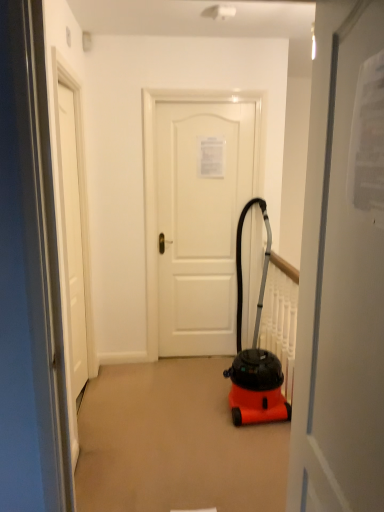
I want to click on white matte door at center, placed as the 2th door when sorted from front to back, so click(x=72, y=240).

Identify the location of white matte door at center, positioned as the 3th door in front-to-back order. (201, 221).

Measure the distance between point (x=317, y=465) and camera.

Point (x=317, y=465) and camera are 3.73 feet apart.

What are the coordinates of `white matte door at center, placed as the 2th door when sorted from front to back` in the screenshot? It's located at (72, 240).

Is white matte door at center, arranged as the 1th door when viewed from the front, facing towards white matte door at center, placed as the 2th door when sorted from front to back?

No, white matte door at center, arranged as the 1th door when viewed from the front, is not oriented towards white matte door at center, placed as the 2th door when sorted from front to back.

From the image's perspective, between white matte door at center, placed as the 3th door when sorted from back to front, and white matte door at center, placed as the 2th door when sorted from front to back, which one is located above?

white matte door at center, placed as the 2th door when sorted from front to back, is shown above in the image.

Is the depth of white matte door at center, arranged as the 1th door when viewed from the right, less than that of white matte door at center, the first door when ordered from left to right?

Yes, white matte door at center, arranged as the 1th door when viewed from the right, is closer to the camera.

Could you measure the distance between white matte door at center, placed as the 2th door when sorted from front to back, and white matte door at center, positioned as the 3th door in front-to-back order?

white matte door at center, placed as the 2th door when sorted from front to back, is 35.79 inches from white matte door at center, positioned as the 3th door in front-to-back order.

Could you tell me if white matte door at center, the first door when ordered from left to right, is facing white matte door at center, the 2th door in the left-to-right sequence?

Yes, white matte door at center, the first door when ordered from left to right, is facing white matte door at center, the 2th door in the left-to-right sequence.

From a real-world perspective, which is physically below, white matte door at center, placed as the 2th door when sorted from front to back, or white matte door at center, positioned as the 3th door in front-to-back order?

From a 3D spatial view, white matte door at center, placed as the 2th door when sorted from front to back, is below.

Who is shorter, white matte door at center, placed as the 2th door when sorted from front to back, or white matte door at center, positioned as the 3th door in front-to-back order?

Standing shorter between the two is white matte door at center, positioned as the 3th door in front-to-back order.

Can you confirm if white matte door at center, the 1th door when ordered from back to front, is shorter than white matte door at center, the 3th door viewed from the left?

No, white matte door at center, the 1th door when ordered from back to front, is not shorter than white matte door at center, the 3th door viewed from the left.

Based on the photo, which object is closer to the camera taking this photo, white matte door at center, the 1th door when ordered from back to front, or white matte door at center, the 3th door viewed from the left?

white matte door at center, the 3th door viewed from the left, is more forward.

Is point (201, 340) less distant than point (332, 281)?

No, it is behind (332, 281).

From a real-world perspective, who is located higher, white matte door at center, positioned as the 3th door in front-to-back order, or white matte door at center, arranged as the 1th door when viewed from the front?

From a 3D spatial view, white matte door at center, arranged as the 1th door when viewed from the front, is above.

From the image's perspective, is orange matte vacuum cleaner at center under white matte door at center, the 2th door in the left-to-right sequence?

Yes, from the image's perspective, orange matte vacuum cleaner at center is below white matte door at center, the 2th door in the left-to-right sequence.

The image size is (384, 512). What are the coordinates of `equipment on the right of white matte door at center, positioned as the 3th door in front-to-back order` in the screenshot? It's located at [x=255, y=355].

Which is correct: orange matte vacuum cleaner at center is inside white matte door at center, the 1th door when ordered from back to front, or outside of it?

orange matte vacuum cleaner at center cannot be found inside white matte door at center, the 1th door when ordered from back to front.

Which object is wider, orange matte vacuum cleaner at center or white matte door at center, positioned as the 3th door in front-to-back order?

orange matte vacuum cleaner at center.

How different are the orientations of orange matte vacuum cleaner at center and white matte door at center, the first door when ordered from left to right, in degrees?

The angle between the facing direction of orange matte vacuum cleaner at center and the facing direction of white matte door at center, the first door when ordered from left to right, is 91.5 degrees.

Is orange matte vacuum cleaner at center positioned beyond the bounds of white matte door at center, placed as the 2th door when sorted from front to back?

Yes, orange matte vacuum cleaner at center is not within white matte door at center, placed as the 2th door when sorted from front to back.

From a real-world perspective, is orange matte vacuum cleaner at center over white matte door at center, placed as the 2th door when sorted from front to back?

Incorrect, from a real-world perspective, orange matte vacuum cleaner at center is lower than white matte door at center, placed as the 2th door when sorted from front to back.

Considering the sizes of orange matte vacuum cleaner at center and white matte door at center, which ranks as the third door in right-to-left order, in the image, is orange matte vacuum cleaner at center bigger or smaller than white matte door at center, which ranks as the third door in right-to-left order,?

Considering their sizes, orange matte vacuum cleaner at center takes up more space than white matte door at center, which ranks as the third door in right-to-left order.

Does point (56, 129) appear closer or farther from the camera than point (236, 358)?

Point (56, 129).

From the image's perspective, would you say white matte door at center, placed as the 2th door when sorted from front to back, is shown under orange matte vacuum cleaner at center?

No, from the image's perspective, white matte door at center, placed as the 2th door when sorted from front to back, is not below orange matte vacuum cleaner at center.

How many degrees apart are the facing directions of white matte door at center, positioned as the second door in back-to-front order, and orange matte vacuum cleaner at center?

They differ by 91.5 degrees in their facing directions.

From a real-world perspective, is white matte door at center, which ranks as the third door in right-to-left order, positioned under orange matte vacuum cleaner at center based on gravity?

No.

Locate an element on the screen. The width and height of the screenshot is (384, 512). door that is the 2nd one when counting downward from the white matte door at center, the second door when ordered from right to left (from the image's perspective) is located at coordinates (342, 274).

From a real-world perspective, between white matte door at center, arranged as the 1th door when viewed from the front, and white matte door at center, positioned as the 3th door in front-to-back order, who is vertically lower?

white matte door at center, positioned as the 3th door in front-to-back order, from a real-world perspective.

Considering the positions of points (329, 95) and (168, 217), is point (329, 95) closer to camera compared to point (168, 217)?

Yes, point (329, 95) is in front of point (168, 217).

From the image's perspective, is white matte door at center, arranged as the 1th door when viewed from the front, under white matte door at center, the second door when ordered from right to left?

Yes.

Image resolution: width=384 pixels, height=512 pixels. Identify the location of the 1st door behind the white matte door at center, placed as the 3th door when sorted from back to front. (72, 240).

Locate an element on the screen. The height and width of the screenshot is (512, 384). door to the left of white matte door at center, the 1th door when ordered from back to front is located at coordinates (72, 240).

Looking at the image, which one is located closer to white matte door at center, arranged as the 1th door when viewed from the right, white matte door at center, the 2th door in the left-to-right sequence, or orange matte vacuum cleaner at center?

Among the two, orange matte vacuum cleaner at center is located nearer to white matte door at center, arranged as the 1th door when viewed from the right.

Estimate the real-world distances between objects in this image. Which object is closer to white matte door at center, which ranks as the third door in right-to-left order, white matte door at center, the 1th door when ordered from back to front, or orange matte vacuum cleaner at center?

Among the two, white matte door at center, the 1th door when ordered from back to front, is located nearer to white matte door at center, which ranks as the third door in right-to-left order.

Which object lies further to the anchor point white matte door at center, arranged as the 1th door when viewed from the front, orange matte vacuum cleaner at center or white matte door at center, the 2th door in the left-to-right sequence?

white matte door at center, the 2th door in the left-to-right sequence, lies further to white matte door at center, arranged as the 1th door when viewed from the front, than the other object.

Looking at the image, which one is located further to orange matte vacuum cleaner at center, white matte door at center, positioned as the second door in back-to-front order, or white matte door at center, the second door when ordered from right to left?

Among the two, white matte door at center, positioned as the second door in back-to-front order, is located further to orange matte vacuum cleaner at center.

Estimate the real-world distances between objects in this image. Which object is closer to white matte door at center, arranged as the 1th door when viewed from the front, white matte door at center, the 2th door in the left-to-right sequence, or white matte door at center, placed as the 2th door when sorted from front to back?

Among the two, white matte door at center, placed as the 2th door when sorted from front to back, is located nearer to white matte door at center, arranged as the 1th door when viewed from the front.

Based on their spatial positions, is white matte door at center, arranged as the 1th door when viewed from the right, or white matte door at center, the 2th door in the left-to-right sequence, closer to orange matte vacuum cleaner at center?

white matte door at center, the 2th door in the left-to-right sequence, lies closer to orange matte vacuum cleaner at center than the other object.

When comparing their distances from white matte door at center, positioned as the second door in back-to-front order, does orange matte vacuum cleaner at center or white matte door at center, placed as the 3th door when sorted from back to front, seem closer?

Based on the image, orange matte vacuum cleaner at center appears to be nearer to white matte door at center, positioned as the second door in back-to-front order.

Estimate the real-world distances between objects in this image. Which object is further from orange matte vacuum cleaner at center, white matte door at center, which ranks as the third door in right-to-left order, or white matte door at center, arranged as the 1th door when viewed from the front?

white matte door at center, arranged as the 1th door when viewed from the front, lies further to orange matte vacuum cleaner at center than the other object.

Find the location of a particular element. equipment located between white matte door at center, arranged as the 1th door when viewed from the front, and white matte door at center, the 1th door when ordered from back to front, in the depth direction is located at coordinates (255, 355).

Locate an element on the screen. The height and width of the screenshot is (512, 384). door between white matte door at center, arranged as the 1th door when viewed from the front, and orange matte vacuum cleaner at center from front to back is located at coordinates (72, 240).

Locate an element on the screen. The image size is (384, 512). door located between white matte door at center, arranged as the 1th door when viewed from the right, and white matte door at center, positioned as the 3th door in front-to-back order, in the depth direction is located at coordinates (72, 240).